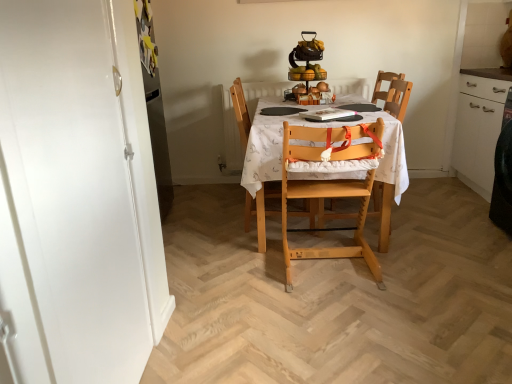
Where is `free space in front of light wood highchair at center, which is counted as the second chair, starting from the left`? free space in front of light wood highchair at center, which is counted as the second chair, starting from the left is located at coordinates (348, 306).